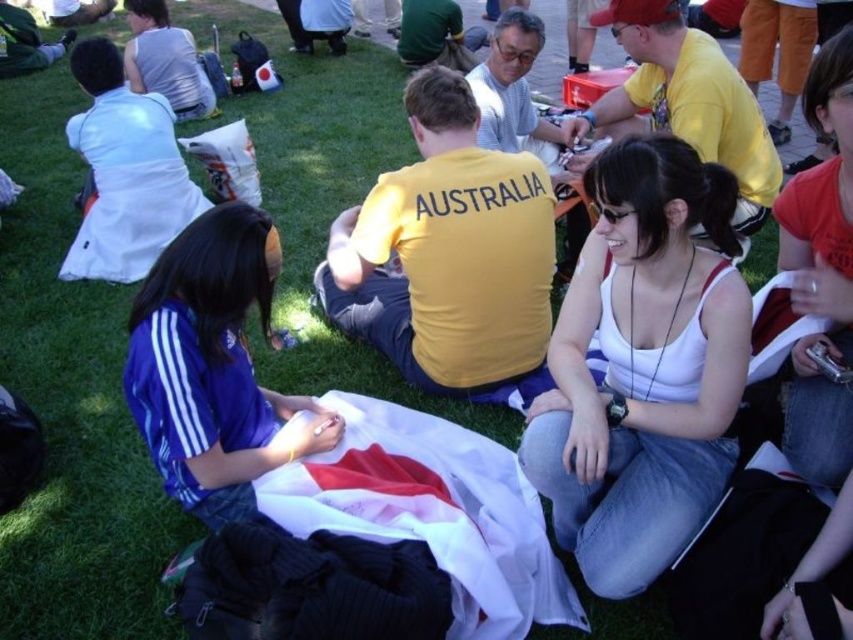
Question: Considering the relative positions of white fabric at center and blue jersey at center in the image provided, where is white fabric at center located with respect to blue jersey at center?

Choices:
 (A) above
 (B) below

Answer: (A)

Question: Which point appears closest to the camera in this image?

Choices:
 (A) (610, 312)
 (B) (199, 442)

Answer: (B)

Question: Which point is farther to the camera?

Choices:
 (A) white fabric at center
 (B) blue jersey at center

Answer: (B)

Question: Can you confirm if white fabric at center is thinner than blue jersey at center?

Choices:
 (A) yes
 (B) no

Answer: (B)

Question: Can you confirm if white fabric at center is smaller than blue jersey at center?

Choices:
 (A) no
 (B) yes

Answer: (A)